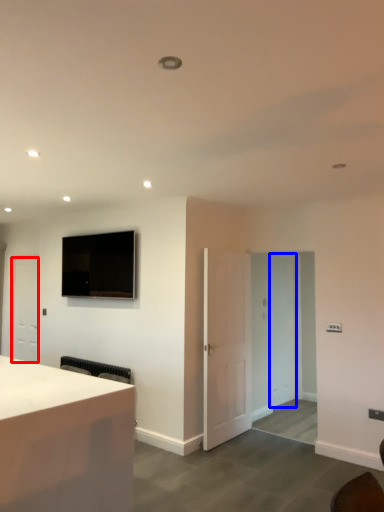
Question: Which of the following is the closest to the observer, door (highlighted by a red box) or glass door (highlighted by a blue box)?

Choices:
 (A) door
 (B) glass door

Answer: (B)